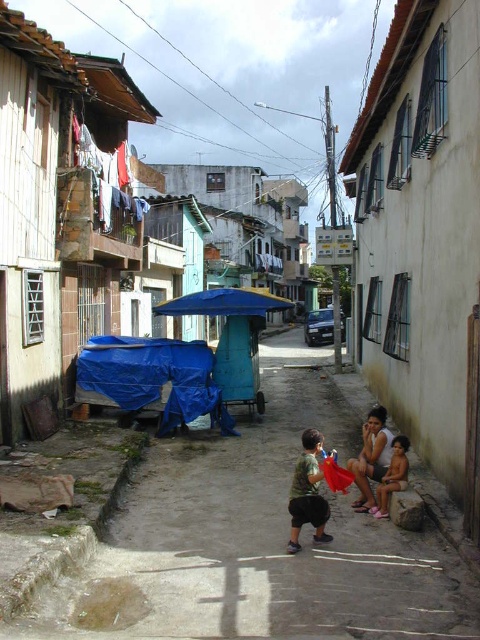
What do you see at coordinates (154, 378) in the screenshot? I see `blue tarpaulin at lower left` at bounding box center [154, 378].

Between point (159, 349) and point (371, 467), which one is positioned in front?

Point (371, 467) is more forward.

Locate an element on the screen. Image resolution: width=480 pixels, height=640 pixels. blue tarpaulin at lower left is located at coordinates (154, 378).

Consider the image. Between blue tarpaulin cart at center and camouflage fabric shirt at center, which one has less height?

Standing shorter between the two is blue tarpaulin cart at center.

Which of these two, blue tarpaulin cart at center or camouflage fabric shirt at center, stands taller?

Standing taller between the two is camouflage fabric shirt at center.

Is point (265, 616) more distant than point (305, 432)?

No, (265, 616) is in front of (305, 432).

This screenshot has width=480, height=640. In order to click on blue tarpaulin cart at center in this screenshot , I will do `click(255, 541)`.

Based on the photo, is camouflage fabric shirt at center shorter than light brown skin at lower right?

No.

Is point (322, 528) positioned behind point (405, 484)?

No, (322, 528) is closer to viewer.

Which is behind, point (291, 522) or point (395, 458)?

The point (395, 458) is more distant.

Locate an element on the screen. camouflage fabric shirt at center is located at coordinates (308, 492).